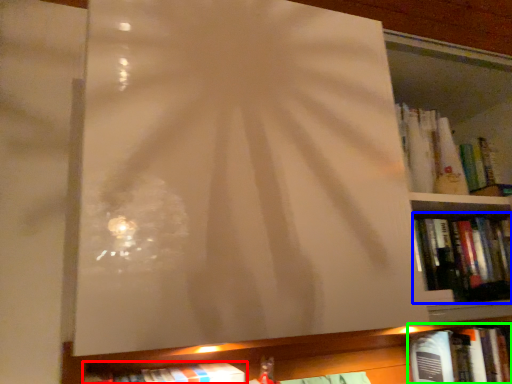
Question: Based on their relative distances, which object is nearer to book (highlighted by a red box)? Choose from book (highlighted by a blue box) and book (highlighted by a green box).

Choices:
 (A) book
 (B) book

Answer: (A)